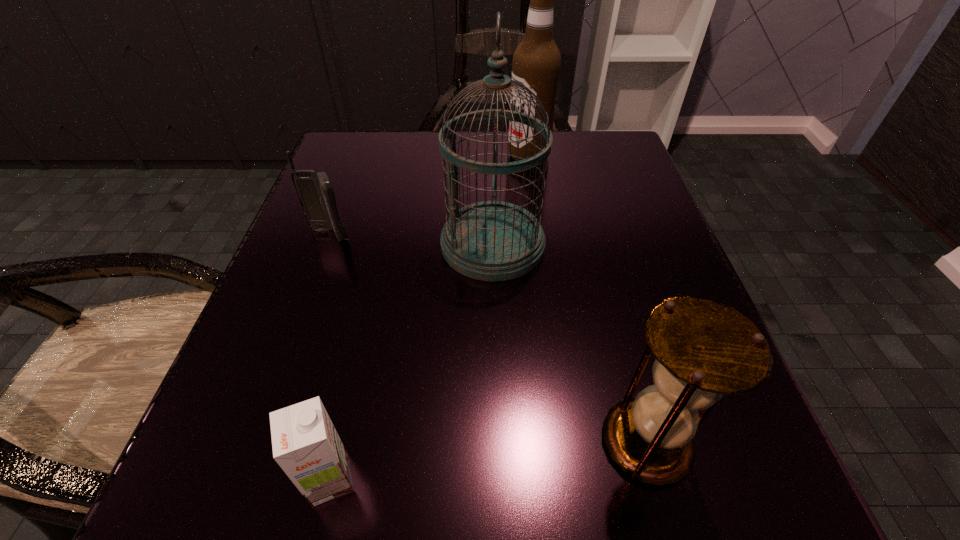
Locate an element on the screen. The height and width of the screenshot is (540, 960). object located in the near left corner section of the desktop is located at coordinates (305, 443).

You are a GUI agent. You are given a task and a screenshot of the screen. Output one action in this format:
    pyautogui.click(x=<x>, y=<y>)
    Task: Click on the object present at the near right corner
    
    Given the screenshot: What is the action you would take?
    pyautogui.click(x=703, y=348)

Where is `blank space at the far edge`? blank space at the far edge is located at coordinates (514, 183).

You are a GUI agent. You are given a task and a screenshot of the screen. Output one action in this format:
    pyautogui.click(x=<x>, y=<y>)
    Task: Click on the vacant point at the near edge
    This screenshot has width=960, height=540.
    Given the screenshot: What is the action you would take?
    pyautogui.click(x=494, y=523)

Identify the location of vacant region at the left edge of the desktop. This screenshot has height=540, width=960. (331, 416).

The image size is (960, 540). What are the coordinates of `blank space at the right edge of the desktop` in the screenshot? It's located at (627, 294).

I want to click on free space at the near left corner of the desktop, so click(x=173, y=502).

You are a GUI agent. You are given a task and a screenshot of the screen. Output one action in this format:
    pyautogui.click(x=<x>, y=<y>)
    Task: Click on the vacant space at the far right corner
    
    Given the screenshot: What is the action you would take?
    pyautogui.click(x=605, y=145)

Find the location of a particular element. The width and height of the screenshot is (960, 540). vacant area between the chocolate milk and the birdcage is located at coordinates (412, 362).

Find the location of `vacant area that lies between the birdcage and the farthest object`. vacant area that lies between the birdcage and the farthest object is located at coordinates (511, 200).